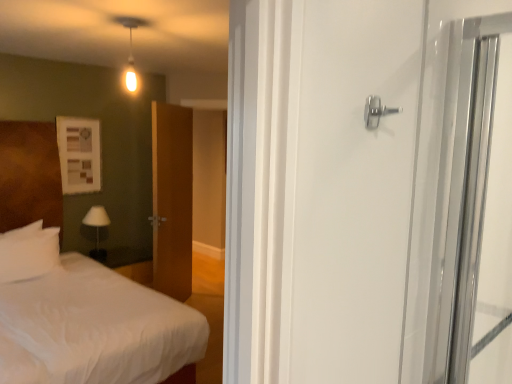
Question: Does white soft bed at left lie in front of white fabric lampshade at left?

Choices:
 (A) yes
 (B) no

Answer: (A)

Question: From the image's perspective, is white soft bed at left beneath white fabric lampshade at left?

Choices:
 (A) no
 (B) yes

Answer: (B)

Question: From the image's perspective, does white soft bed at left appear higher than white fabric lampshade at left?

Choices:
 (A) no
 (B) yes

Answer: (A)

Question: Is white soft bed at left further to the viewer compared to white fabric lampshade at left?

Choices:
 (A) no
 (B) yes

Answer: (A)

Question: Is there a large distance between white soft bed at left and white fabric lampshade at left?

Choices:
 (A) no
 (B) yes

Answer: (A)

Question: In the image, is white soft bed at left positioned in front of or behind polished silver door handle at upper right?

Choices:
 (A) behind
 (B) front

Answer: (A)

Question: In terms of width, does white soft bed at left look wider or thinner when compared to polished silver door handle at upper right?

Choices:
 (A) thin
 (B) wide

Answer: (B)

Question: Based on their sizes in the image, would you say white soft bed at left is bigger or smaller than polished silver door handle at upper right?

Choices:
 (A) big
 (B) small

Answer: (A)

Question: Is white soft bed at left inside or outside of polished silver door handle at upper right?

Choices:
 (A) inside
 (B) outside

Answer: (B)

Question: From their relative heights in the image, would you say white soft pillow at left is taller or shorter than white fabric lampshade at left?

Choices:
 (A) tall
 (B) short

Answer: (A)

Question: In the image, is white soft pillow at left positioned in front of or behind white fabric lampshade at left?

Choices:
 (A) behind
 (B) front

Answer: (B)

Question: Do you think white soft pillow at left is within white fabric lampshade at left, or outside of it?

Choices:
 (A) inside
 (B) outside

Answer: (B)

Question: From a real-world perspective, is white soft pillow at left positioned above or below white fabric lampshade at left?

Choices:
 (A) above
 (B) below

Answer: (A)

Question: Looking at their shapes, would you say white soft pillow at left is wider or thinner than polished silver door handle at upper right?

Choices:
 (A) thin
 (B) wide

Answer: (B)

Question: Would you say white soft pillow at left is to the left or to the right of polished silver door handle at upper right in the picture?

Choices:
 (A) right
 (B) left

Answer: (B)